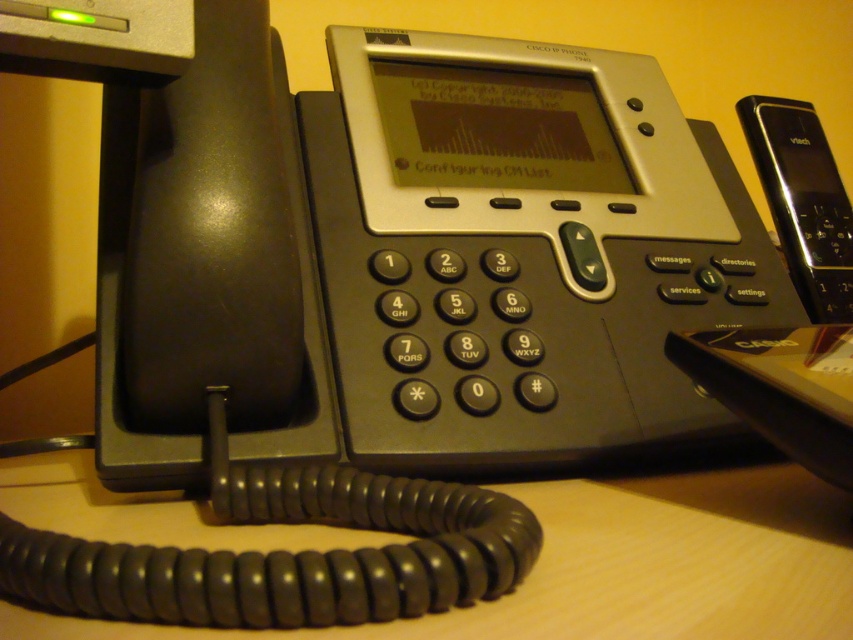
You are organizing a meeting and need to place a wooden table at center and a black plastic phone at right on a desk. According to the scene, which object should be placed to the left of the other?

The wooden table at center is positioned on the left side of black plastic phone at right.

You are a technician who needs to place a new router on the desk. The router requires a minimum of 40 centimeters of space to function properly. Can the wooden table at center accommodate the router next to the black plastic phone at right?

The distance between the wooden table at center and the black plastic phone at right is 39.20 centimeters, which is less than the required 40 centimeters. Therefore, the router cannot be placed there as it does not meet the space requirement.

You are setting up a Cisco IP phone model 7940 on a desk. You have a wooden table at center and a black plastic phone at right. Which object is taller?

The black plastic phone at right is taller than the wooden table at center.